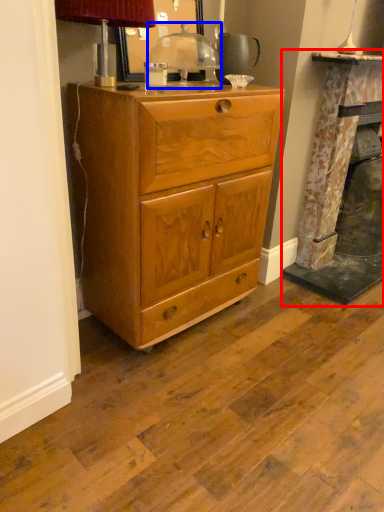
Question: Which point is further to the camera, fireplace (highlighted by a red box) or table lamp (highlighted by a blue box)?

Choices:
 (A) fireplace
 (B) table lamp

Answer: (A)